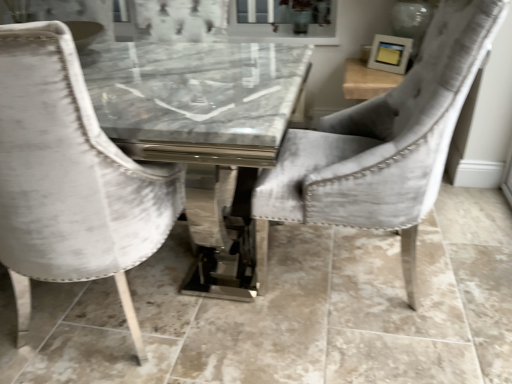
Question: Is velvet gray chair at center, the 2th chair positioned from the left, outside velvet white chair at left, which is the first chair in left-to-right order?

Choices:
 (A) yes
 (B) no

Answer: (A)

Question: Is velvet gray chair at center, which is counted as the 1th chair, starting from the right, further to camera compared to velvet white chair at left, which is the first chair in left-to-right order?

Choices:
 (A) yes
 (B) no

Answer: (A)

Question: From the image's perspective, is velvet gray chair at center, the 2th chair positioned from the left, on top of velvet white chair at left, the second chair positioned from the right?

Choices:
 (A) no
 (B) yes

Answer: (B)

Question: Does velvet gray chair at center, which is counted as the 1th chair, starting from the right, appear on the right side of velvet white chair at left, which is the first chair in left-to-right order?

Choices:
 (A) yes
 (B) no

Answer: (A)

Question: Is velvet gray chair at center, which is counted as the 1th chair, starting from the right, facing away from velvet white chair at left, the second chair positioned from the right?

Choices:
 (A) no
 (B) yes

Answer: (A)

Question: Can you confirm if velvet gray chair at center, which is counted as the 1th chair, starting from the right, is wider than velvet white chair at left, which is the first chair in left-to-right order?

Choices:
 (A) no
 (B) yes

Answer: (B)

Question: Can you confirm if velvet white chair at left, which is the first chair in left-to-right order, is bigger than velvet gray chair at center, which is counted as the 1th chair, starting from the right?

Choices:
 (A) yes
 (B) no

Answer: (B)

Question: Considering the relative sizes of velvet white chair at left, the second chair positioned from the right, and velvet gray chair at center, which is counted as the 1th chair, starting from the right, in the image provided, is velvet white chair at left, the second chair positioned from the right, shorter than velvet gray chair at center, which is counted as the 1th chair, starting from the right,?

Choices:
 (A) yes
 (B) no

Answer: (B)

Question: From a real-world perspective, is velvet white chair at left, which is the first chair in left-to-right order, over velvet gray chair at center, which is counted as the 1th chair, starting from the right?

Choices:
 (A) yes
 (B) no

Answer: (B)

Question: Is velvet white chair at left, which is the first chair in left-to-right order, facing towards velvet gray chair at center, which is counted as the 1th chair, starting from the right?

Choices:
 (A) no
 (B) yes

Answer: (A)

Question: Is velvet white chair at left, which is the first chair in left-to-right order, turned away from velvet gray chair at center, which is counted as the 1th chair, starting from the right?

Choices:
 (A) no
 (B) yes

Answer: (A)

Question: Can we say velvet white chair at left, which is the first chair in left-to-right order, lies outside velvet gray chair at center, the 2th chair positioned from the left?

Choices:
 (A) no
 (B) yes

Answer: (B)

Question: From the image's perspective, relative to velvet gray chair at center, which is counted as the 1th chair, starting from the right, is velvet white chair at left, which is the first chair in left-to-right order, above or below?

Choices:
 (A) below
 (B) above

Answer: (A)